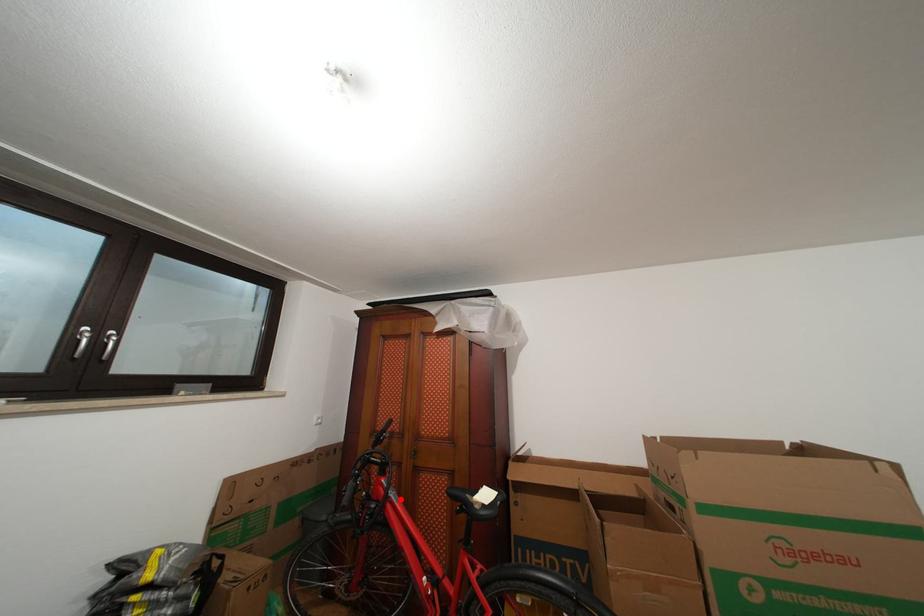
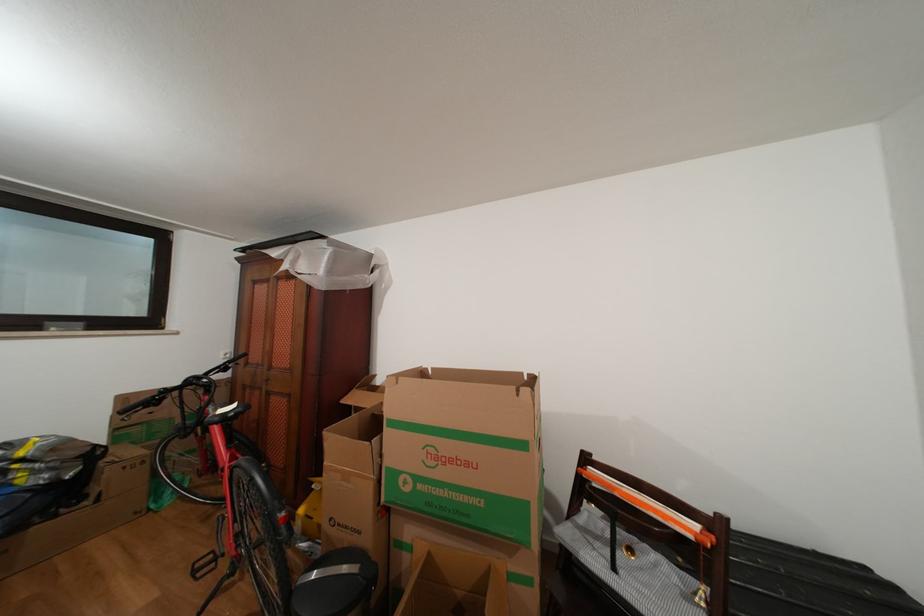
Question: I am providing you with two images of the same scene from different viewpoints. A red point is marked on the first image. At the location where the point appears in image 1, is it still visible in image 2?

Choices:
 (A) Yes
 (B) No

Answer: (A)